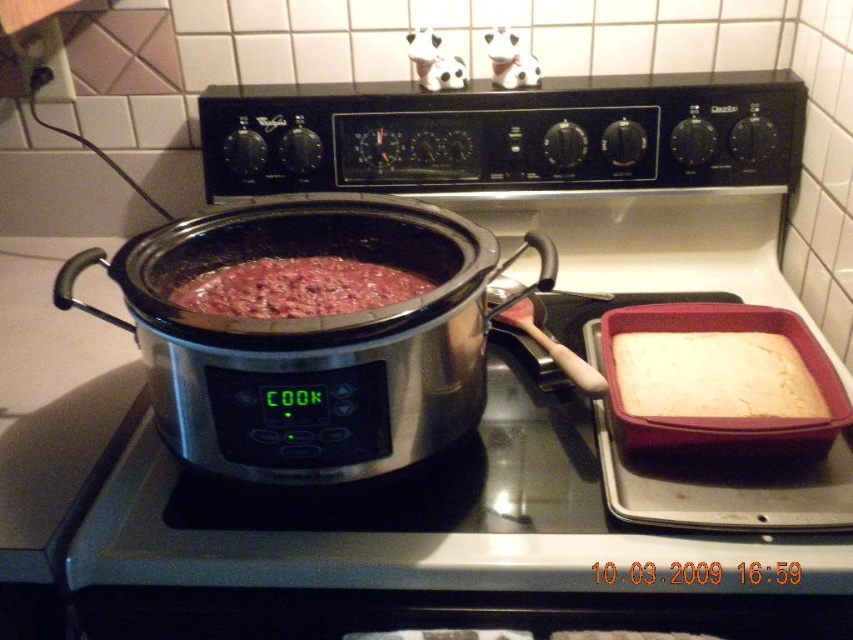
Can you confirm if stainless steel slow cooker at center is taller than brown matte pot at center?

Indeed, stainless steel slow cooker at center has a greater height compared to brown matte pot at center.

This screenshot has height=640, width=853. What do you see at coordinates (436, 518) in the screenshot? I see `stainless steel slow cooker at center` at bounding box center [436, 518].

Locate an element on the screen. The height and width of the screenshot is (640, 853). stainless steel slow cooker at center is located at coordinates (436, 518).

Which is more to the right, stainless steel slow cooker at center or white fluffy cake at right?

white fluffy cake at right

Is stainless steel slow cooker at center thinner than white fluffy cake at right?

No, stainless steel slow cooker at center is not thinner than white fluffy cake at right.

This screenshot has height=640, width=853. Find the location of `stainless steel slow cooker at center`. stainless steel slow cooker at center is located at coordinates (436, 518).

Which of these two, white fluffy cake at right or brown matte pot at center, stands shorter?

Standing shorter between the two is brown matte pot at center.

Does white fluffy cake at right have a larger size compared to brown matte pot at center?

Yes, white fluffy cake at right is bigger than brown matte pot at center.

Is point (785, 410) farther from camera compared to point (296, 300)?

No, it is in front of (296, 300).

Identify the location of white fluffy cake at right. The image size is (853, 640). (712, 376).